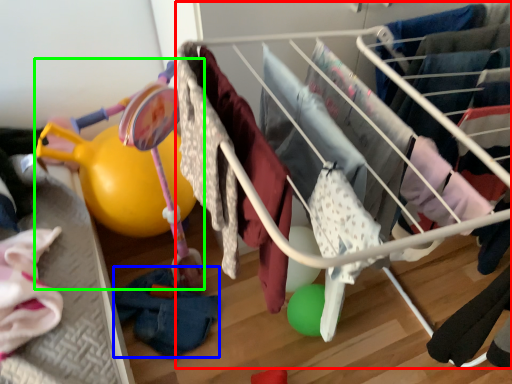
Question: Estimate the real-world distances between objects in this image. Which object is farther from infant bed (highlighted by a red box), clothing (highlighted by a blue box) or baby carriage (highlighted by a green box)?

Choices:
 (A) clothing
 (B) baby carriage

Answer: (A)